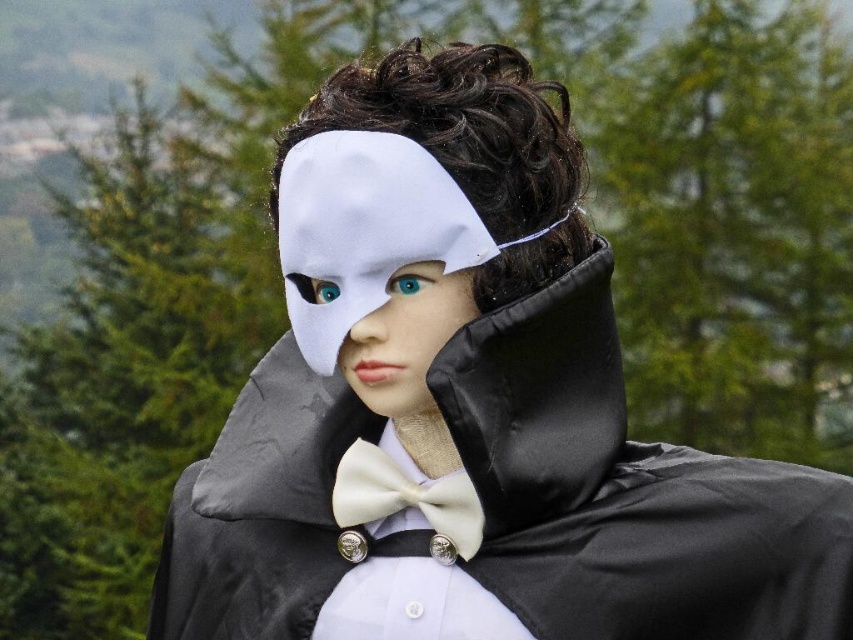
Question: Is teal glossy eye at center smaller than matte plastic eye at center?

Choices:
 (A) no
 (B) yes

Answer: (B)

Question: Which object is the farthest from the teal glossy eye at center?

Choices:
 (A) white matte mask at center
 (B) matte plastic eye at center

Answer: (A)

Question: Which object appears closest to the camera in this image?

Choices:
 (A) white matte mask at center
 (B) teal glossy eye at center
 (C) ivory satin bow tie at center

Answer: (A)

Question: Observing the image, what is the correct spatial positioning of teal glossy eye at center in reference to matte plastic eye at center?

Choices:
 (A) left
 (B) right

Answer: (B)

Question: Is white matte mask at center positioned before matte plastic eye at center?

Choices:
 (A) yes
 (B) no

Answer: (A)

Question: Among these points, which one is farthest from the camera?

Choices:
 (A) tap(428, 212)
 (B) tap(374, 490)
 (C) tap(422, 292)

Answer: (B)